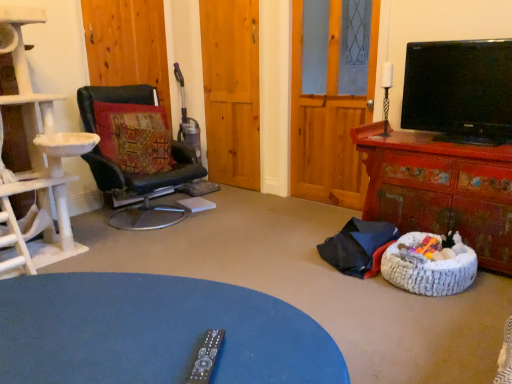
Question: Is point (411, 251) closer or farther from the camera than point (439, 192)?

Choices:
 (A) farther
 (B) closer

Answer: (B)

Question: In terms of size, does white woven dog bed at lower right appear bigger or smaller than distressed red wooden cabinet at right?

Choices:
 (A) big
 (B) small

Answer: (B)

Question: Estimate the real-world distances between objects in this image. Which object is closer to the wooden door at center, the first door positioned from the right?

Choices:
 (A) distressed red wooden cabinet at right
 (B) black glossy tv at upper right
 (C) white woven dog bed at lower right
 (D) wooden glass door at center
 (E) black fabric remote control at center

Answer: (D)

Question: Which is nearer to the black leather chair at left?

Choices:
 (A) wooden door at center, the 2th door when ordered from left to right
 (B) white woven dog bed at lower right
 (C) black glossy tv at upper right
 (D) textured fabric pillow at left
 (E) wooden door at center, the first door viewed from the left

Answer: (D)